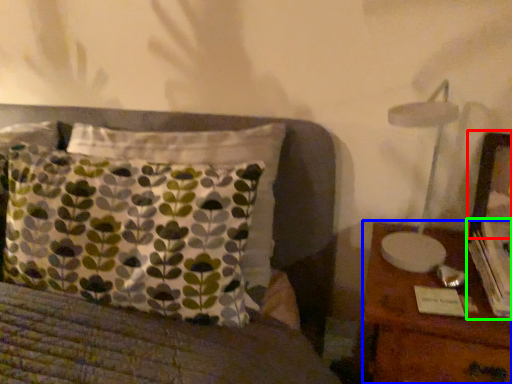
Question: Estimate the real-world distances between objects in this image. Which object is closer to picture frame (highlighted by a red box), nightstand (highlighted by a blue box) or book (highlighted by a green box)?

Choices:
 (A) nightstand
 (B) book

Answer: (B)